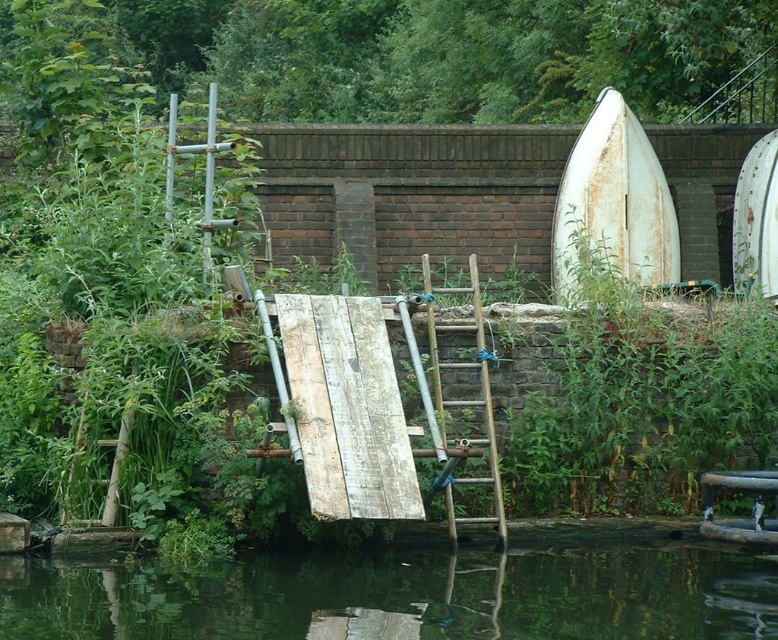
You are a delivery person who needs to place a large package on the water surface near the rusty white boat at upper right and the white matte surfboard at upper right. Which object can you use as a base to place the package without it floating away?

The rusty white boat at upper right is bigger than the white matte surfboard at upper right, so the package can be placed on the rusty white boat at upper right as it provides a larger and more stable base.

You are a painter who wants to paint both the rusty white boat at upper right and the wooden ladder at center. Since you can only carry a ladder of a certain height, which object requires a taller ladder to reach its top?

The rusty white boat at upper right requires a taller ladder to reach its top because it is much taller than the wooden ladder at center.